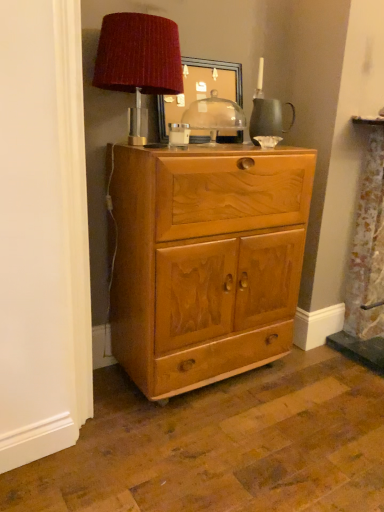
Question: Is light brown wood cabinet at center oriented away from wooden picture frame at upper center?

Choices:
 (A) no
 (B) yes

Answer: (A)

Question: Is light brown wood cabinet at center to the left of wooden picture frame at upper center from the viewer's perspective?

Choices:
 (A) yes
 (B) no

Answer: (B)

Question: Would you say wooden picture frame at upper center is part of light brown wood cabinet at center's contents?

Choices:
 (A) yes
 (B) no

Answer: (B)

Question: Can you confirm if light brown wood cabinet at center is taller than wooden picture frame at upper center?

Choices:
 (A) no
 (B) yes

Answer: (B)

Question: From the image's perspective, is light brown wood cabinet at center beneath wooden picture frame at upper center?

Choices:
 (A) yes
 (B) no

Answer: (A)

Question: Considering the relative sizes of light brown wood cabinet at center and wooden picture frame at upper center in the image provided, is light brown wood cabinet at center wider than wooden picture frame at upper center?

Choices:
 (A) no
 (B) yes

Answer: (B)

Question: Is transparent glass dome at center inside light brown wood cabinet at center?

Choices:
 (A) yes
 (B) no

Answer: (B)

Question: From a real-world perspective, is light brown wood cabinet at center over transparent glass dome at center?

Choices:
 (A) no
 (B) yes

Answer: (A)

Question: Can you confirm if light brown wood cabinet at center is thinner than transparent glass dome at center?

Choices:
 (A) yes
 (B) no

Answer: (B)

Question: Are light brown wood cabinet at center and transparent glass dome at center far apart?

Choices:
 (A) no
 (B) yes

Answer: (A)

Question: Is transparent glass dome at center at the back of light brown wood cabinet at center?

Choices:
 (A) yes
 (B) no

Answer: (B)

Question: Can you see light brown wood cabinet at center touching transparent glass dome at center?

Choices:
 (A) no
 (B) yes

Answer: (A)

Question: Does wooden picture frame at upper center have a greater height compared to velvet red lampshade at upper center?

Choices:
 (A) yes
 (B) no

Answer: (B)